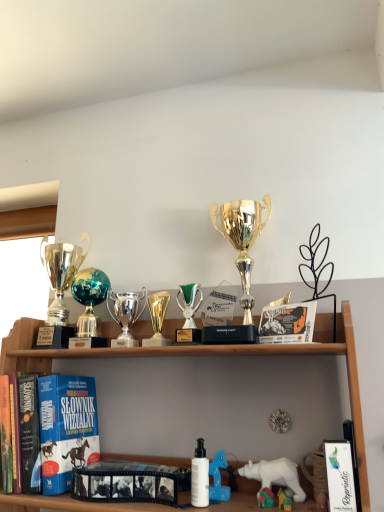
Question: Which is correct: white plastic bear at lower right, positioned as the fifth toy in left-to-right order, is inside shiny silver trophy at center, marked as the 4th toy in a right-to-left arrangement, or outside of it?

Choices:
 (A) outside
 (B) inside

Answer: (A)

Question: Is white plastic bear at lower right, placed as the 1th toy when sorted from right to left, to the left or to the right of shiny silver trophy at center, marked as the 4th toy in a right-to-left arrangement, in the image?

Choices:
 (A) left
 (B) right

Answer: (B)

Question: Considering the real-world distances, which object is closest to the white plastic bear at lower center?

Choices:
 (A) white plastic bear at lower right, placed as the 1th toy when sorted from right to left
 (B) black matte film strip at center, which appears as the second book when viewed from the front
 (C) shiny silver trophy at left, placed as the 1th trophy when sorted from left to right
 (D) shiny metallic globe at center, the 5th toy in the right-to-left sequence
 (E) white glossy book at lower right, the third book when ordered from back to front

Answer: (A)

Question: Considering the real-world distances, which object is closest to the shiny silver trophy at left, which is counted as the second trophy, starting from the right?

Choices:
 (A) white plastic bear at lower right, positioned as the fifth toy in left-to-right order
 (B) white plastic bear at lower center
 (C) gold metallic trophy at center, which is the 3th toy from left to right
 (D) shiny metallic globe at center, the 5th toy in the right-to-left sequence
 (E) blue matte book at left, placed as the first book when sorted from left to right

Answer: (D)